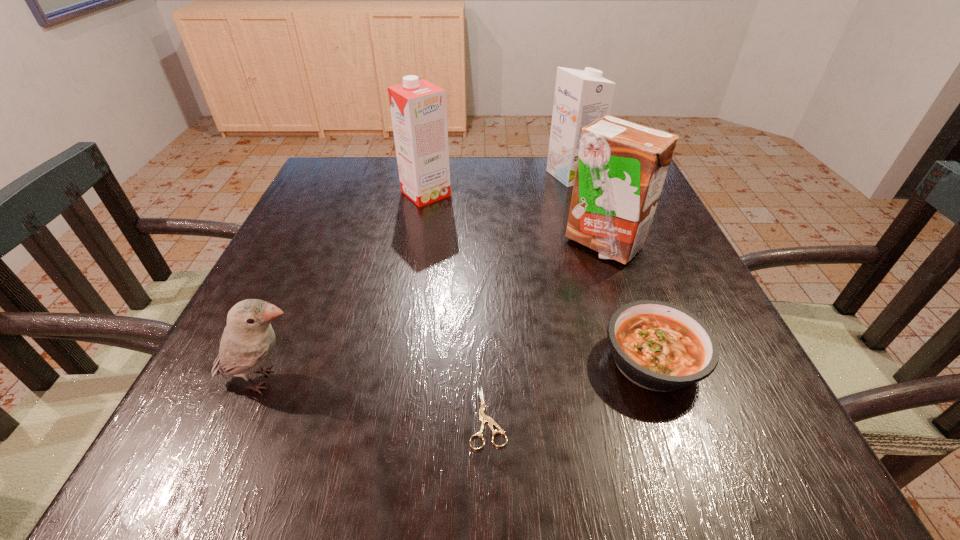
Image resolution: width=960 pixels, height=540 pixels. What are the coordinates of `the fifth object from right to left` in the screenshot? It's located at (418, 108).

Where is `the nearest carton`? the nearest carton is located at coordinates click(621, 169).

Locate an element on the screen. The width and height of the screenshot is (960, 540). the fourth tallest object is located at coordinates (248, 340).

In order to click on bird in this screenshot , I will do `click(248, 340)`.

Locate an element on the screen. This screenshot has height=540, width=960. stew is located at coordinates (659, 346).

What are the coordinates of `the third object from left to right` in the screenshot? It's located at (483, 417).

Locate an element on the screen. shears is located at coordinates (x=483, y=417).

Identify the location of vacant space located on the left of the fifth object from right to left. (334, 193).

You are a GUI agent. You are given a task and a screenshot of the screen. Output one action in this format:
    pyautogui.click(x=<x>, y=<y>)
    Task: Click on the vacant space located 0.140m on the straw side of the third farthest object
    
    Given the screenshot: What is the action you would take?
    pyautogui.click(x=628, y=319)

This screenshot has width=960, height=540. What are the coordinates of `free space located at the face of the bird` in the screenshot? It's located at (449, 380).